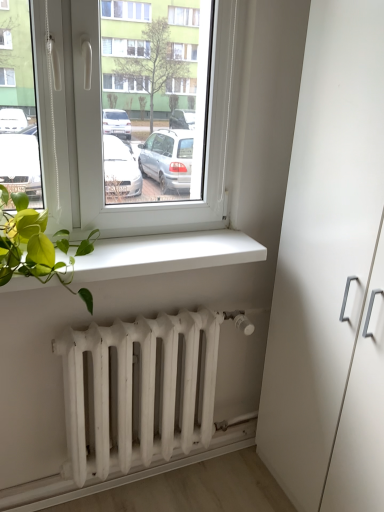
Question: Is white matte cabinet at right wider than white matte window sill at lower center?

Choices:
 (A) no
 (B) yes

Answer: (B)

Question: Is white matte window sill at lower center surrounded by white matte cabinet at right?

Choices:
 (A) yes
 (B) no

Answer: (B)

Question: Is white matte cabinet at right oriented away from white matte window sill at lower center?

Choices:
 (A) no
 (B) yes

Answer: (A)

Question: From a real-world perspective, does white matte cabinet at right stand above white matte window sill at lower center?

Choices:
 (A) no
 (B) yes

Answer: (A)

Question: Can you confirm if white matte cabinet at right is taller than white matte window sill at lower center?

Choices:
 (A) no
 (B) yes

Answer: (B)

Question: In the image, is white matte radiator at lower center positioned in front of or behind white matte window sill at lower center?

Choices:
 (A) behind
 (B) front

Answer: (A)

Question: Is white matte radiator at lower center spatially inside white matte window sill at lower center, or outside of it?

Choices:
 (A) inside
 (B) outside

Answer: (B)

Question: In terms of size, does white matte radiator at lower center appear bigger or smaller than white matte window sill at lower center?

Choices:
 (A) big
 (B) small

Answer: (A)

Question: From the image's perspective, is white matte radiator at lower center positioned above or below white matte window sill at lower center?

Choices:
 (A) above
 (B) below

Answer: (B)

Question: Considering the positions of point (296, 238) and point (72, 485), is point (296, 238) closer or farther from the camera than point (72, 485)?

Choices:
 (A) closer
 (B) farther

Answer: (A)

Question: Considering their positions, is white matte cabinet at right located in front of or behind white matte radiator at lower center?

Choices:
 (A) behind
 (B) front

Answer: (B)

Question: Considering the positions of white matte cabinet at right and white matte radiator at lower center in the image, is white matte cabinet at right taller or shorter than white matte radiator at lower center?

Choices:
 (A) short
 (B) tall

Answer: (B)

Question: Visually, is white matte cabinet at right positioned to the left or to the right of white matte radiator at lower center?

Choices:
 (A) left
 (B) right

Answer: (B)

Question: Is white matte window sill at lower center taller or shorter than white matte radiator at lower center?

Choices:
 (A) tall
 (B) short

Answer: (B)

Question: In the image, is white matte window sill at lower center positioned in front of or behind white matte radiator at lower center?

Choices:
 (A) front
 (B) behind

Answer: (A)